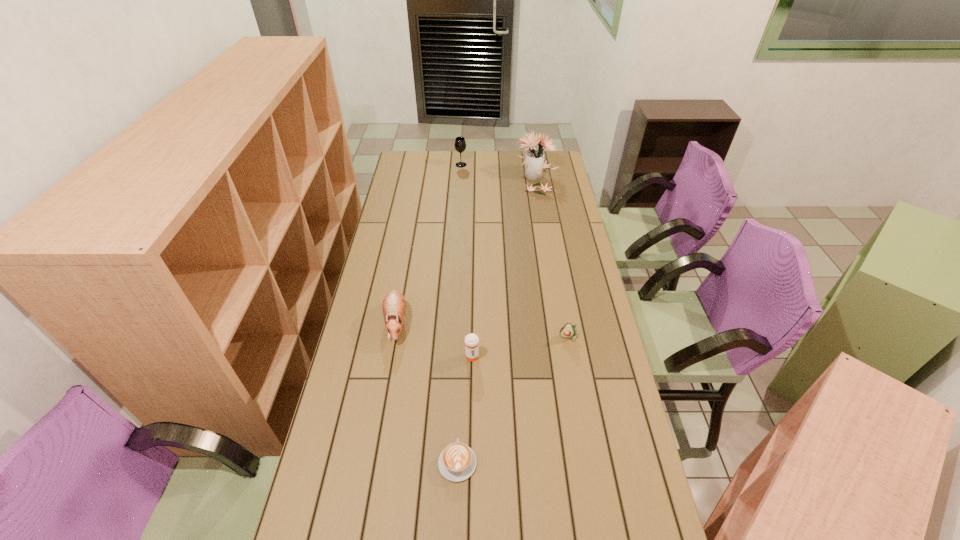
Identify the location of bouquet. This screenshot has height=540, width=960. (534, 163).

Locate an element on the screen. the second tallest object is located at coordinates (460, 144).

At what (x,y) coordinates should I click in order to perform the action: click on the leftmost object. Please return your answer as a coordinate pair (x, y). The height and width of the screenshot is (540, 960). Looking at the image, I should click on (394, 304).

Find the location of a particular element. The width and height of the screenshot is (960, 540). the second nearest object is located at coordinates (471, 340).

Where is `the fifth tallest object`? This screenshot has height=540, width=960. the fifth tallest object is located at coordinates (568, 330).

Locate an element on the screen. the shortest object is located at coordinates (457, 462).

The height and width of the screenshot is (540, 960). Identify the location of the nearest object. (457, 462).

This screenshot has width=960, height=540. I want to click on free space located on the front of the bouquet, so [x=545, y=238].

Find the location of `vacant space located on the front of the wineglass`. vacant space located on the front of the wineglass is located at coordinates (461, 174).

Identify the location of vacant space located 0.180m at the face of the leftmost object. This screenshot has height=540, width=960. (384, 394).